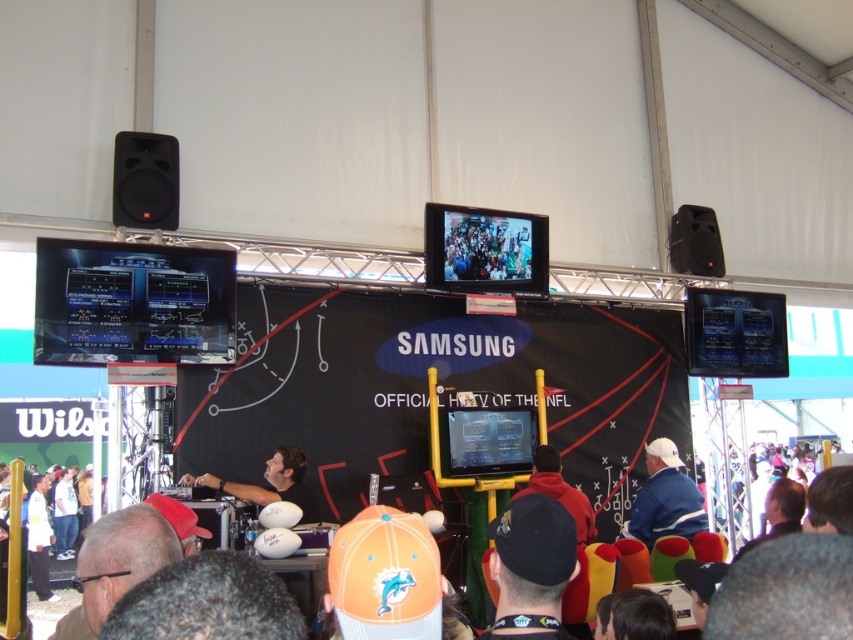
From the picture: You are organizing a photo shoot in the described scene and need to ensure that the smooth skin man at center and the red fleece jacket at center are both visible in the frame. Given that the camera has a fixed focal length, which object should you prioritize positioning closer to the camera to ensure visibility?

The smooth skin man at center should be positioned closer to the camera since his width is larger than the red fleece jacket at center, ensuring both can be captured clearly within the frame.

You are a photographer at the event and need to capture a photo that includes both the dark gray hair at lower left and the black matte speaker at upper left. Which object should be placed on the right side of the photo to ensure both are visible?

The dark gray hair at lower left should be placed on the right side of the photo because it is already positioned to the right of the black matte speaker at upper left.

In the scene shown: You are a photographer at the event and need to capture a clear shot of both the black fabric cap at center and the black matte speaker at upper right. Which object should you focus on first to ensure both are in focus?

You should focus on the black fabric cap at center first because it is closer to the viewer than the black matte speaker at upper right. By focusing on the closer object, the speaker will still be within the depth of field if they are not too far apart.